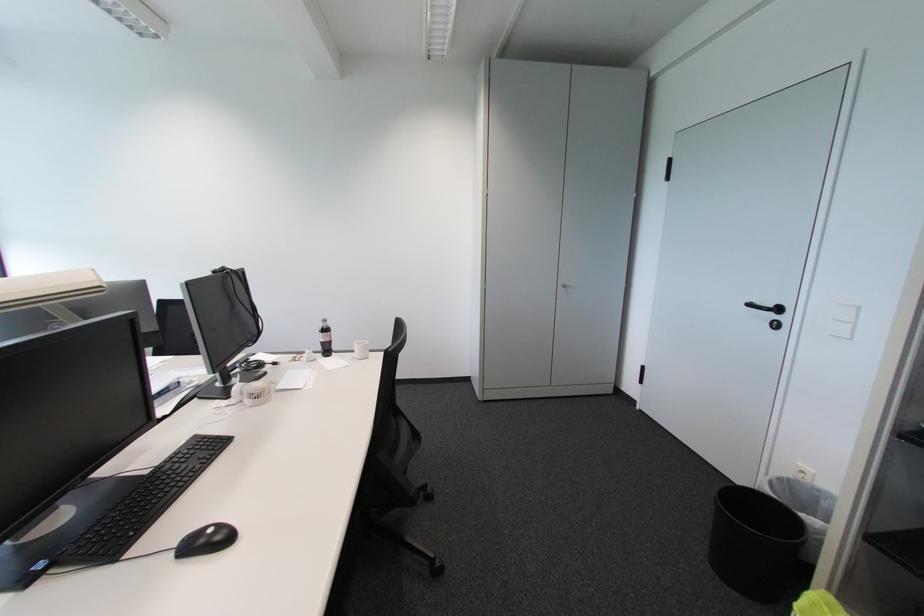
Where would you turn the black door handle? Please return your answer as a coordinate pair (x, y).

(762, 306)